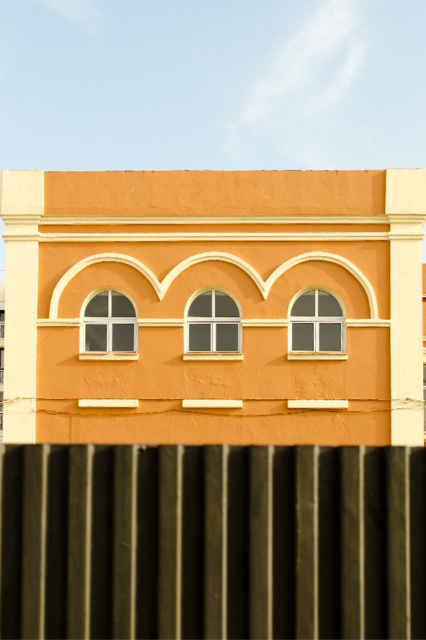
Question: Can you confirm if black corrugated metal fence at lower center is positioned below clear glass window at center?

Choices:
 (A) yes
 (B) no

Answer: (A)

Question: Which of the following is the closest to the observer?

Choices:
 (A) (17, 518)
 (B) (230, 316)

Answer: (A)

Question: Is black corrugated metal fence at lower center to the right of white glass window at upper left from the viewer's perspective?

Choices:
 (A) no
 (B) yes

Answer: (B)

Question: Is the position of clear glass window at center less distant than that of white glass window at upper left?

Choices:
 (A) yes
 (B) no

Answer: (A)

Question: Which is farther from the white glass window at center?

Choices:
 (A) black corrugated metal fence at lower center
 (B) white glass window at upper left

Answer: (A)

Question: Which object is the farthest from the white glass window at upper left?

Choices:
 (A) white glass window at center
 (B) clear glass window at center
 (C) black corrugated metal fence at lower center

Answer: (C)